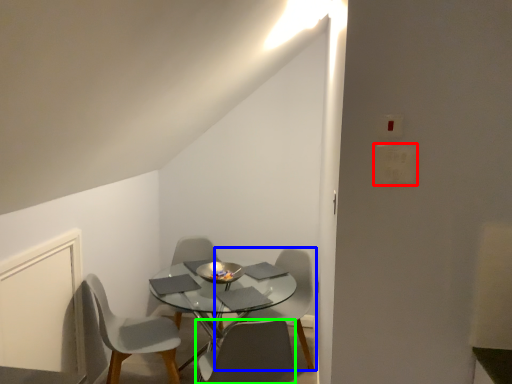
Question: Which object is the farthest from light switch (highlighted by a red box)? Choose among these: chair (highlighted by a blue box) or chair (highlighted by a green box).

Choices:
 (A) chair
 (B) chair

Answer: (A)